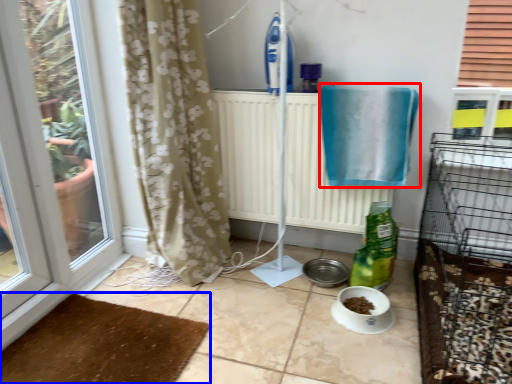
Question: Which of the following is the farthest to the observer, bath towel (highlighted by a red box) or doormat (highlighted by a blue box)?

Choices:
 (A) bath towel
 (B) doormat

Answer: (A)